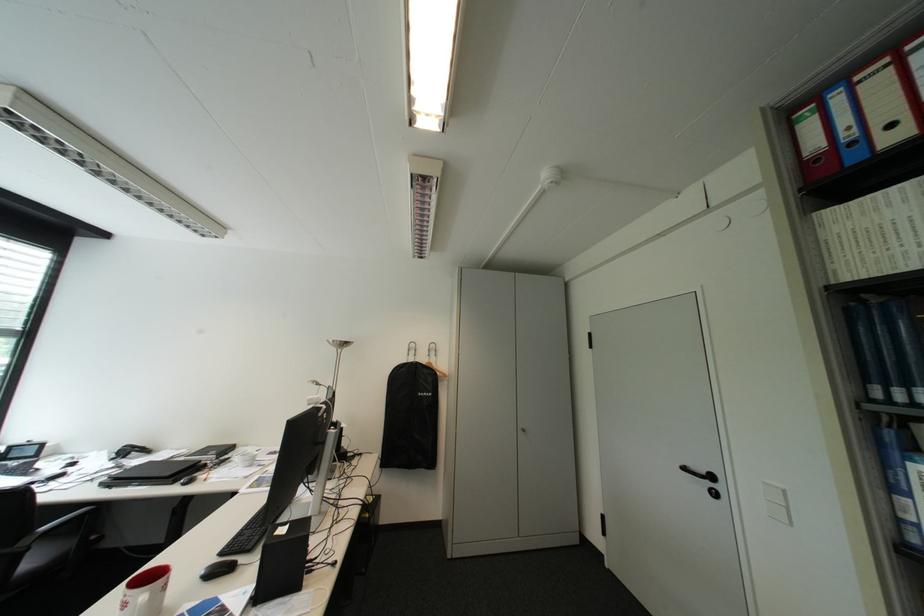
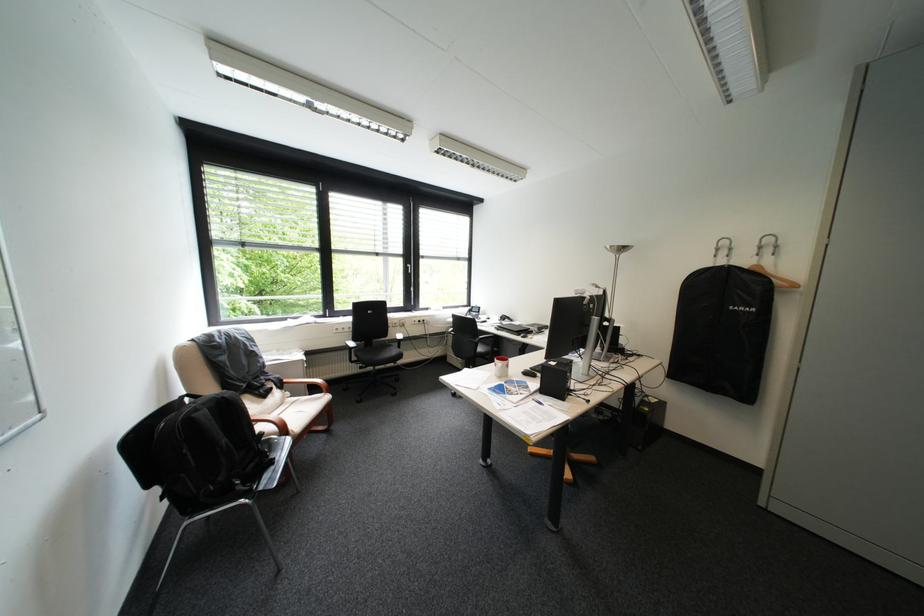
Locate, in the second image, the point that corresponds to [436,394] in the first image.

(755, 309)